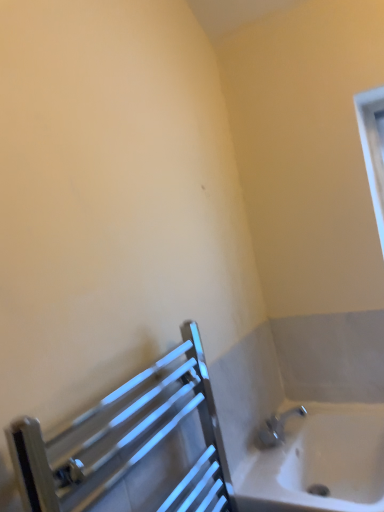
Question: Is polished chrome towel rail at lower left oriented towards white glossy bathtub at lower right?

Choices:
 (A) no
 (B) yes

Answer: (A)

Question: Would you consider polished chrome towel rail at lower left to be distant from white glossy bathtub at lower right?

Choices:
 (A) no
 (B) yes

Answer: (A)

Question: From the image's perspective, is polished chrome towel rail at lower left on white glossy bathtub at lower right?

Choices:
 (A) yes
 (B) no

Answer: (A)

Question: Does polished chrome towel rail at lower left have a lesser height compared to white glossy bathtub at lower right?

Choices:
 (A) yes
 (B) no

Answer: (B)

Question: Is polished chrome towel rail at lower left smaller than white glossy bathtub at lower right?

Choices:
 (A) yes
 (B) no

Answer: (A)

Question: Could white glossy bathtub at lower right be considered to be inside polished chrome towel rail at lower left?

Choices:
 (A) no
 (B) yes

Answer: (A)

Question: Can you confirm if white glossy bathtub at lower right is thinner than polished chrome towel rail at lower left?

Choices:
 (A) no
 (B) yes

Answer: (A)

Question: Considering the relative positions of white glossy bathtub at lower right and polished chrome towel rail at lower left in the image provided, is white glossy bathtub at lower right to the right of polished chrome towel rail at lower left from the viewer's perspective?

Choices:
 (A) yes
 (B) no

Answer: (A)

Question: Is white glossy bathtub at lower right placed right next to polished chrome towel rail at lower left?

Choices:
 (A) no
 (B) yes

Answer: (A)

Question: Considering the relative positions of white glossy bathtub at lower right and polished chrome towel rail at lower left in the image provided, is white glossy bathtub at lower right to the left of polished chrome towel rail at lower left from the viewer's perspective?

Choices:
 (A) no
 (B) yes

Answer: (A)

Question: Does white glossy bathtub at lower right have a larger size compared to polished chrome towel rail at lower left?

Choices:
 (A) yes
 (B) no

Answer: (A)

Question: From a real-world perspective, is white glossy bathtub at lower right on polished chrome towel rail at lower left?

Choices:
 (A) yes
 (B) no

Answer: (B)

Question: Considering the positions of point (289, 474) and point (79, 468), is point (289, 474) closer or farther from the camera than point (79, 468)?

Choices:
 (A) closer
 (B) farther

Answer: (B)